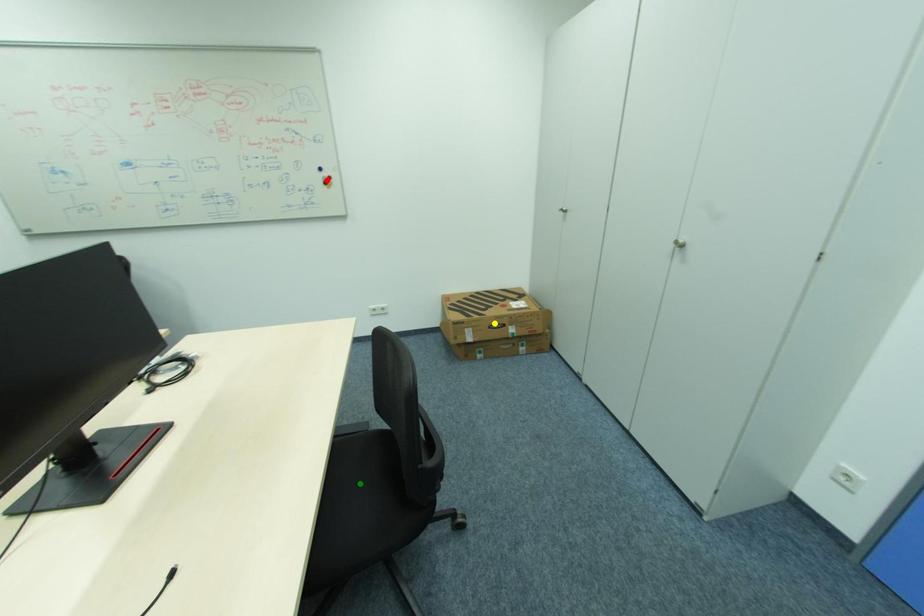
Order these from farthest to nearest:
A) red point
B) green point
C) yellow point

yellow point, red point, green point